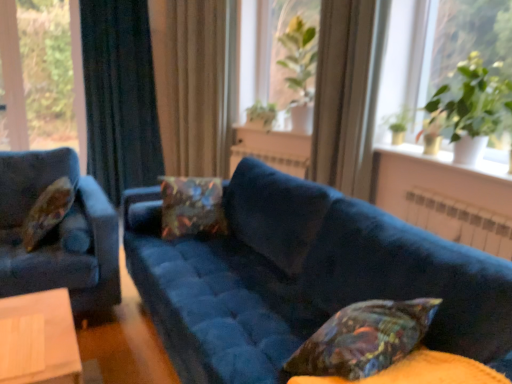
Locate an element on the screen. white metallic radiator at center is located at coordinates (460, 221).

This screenshot has width=512, height=384. What do you see at coordinates (47, 212) in the screenshot? I see `velvet floral pillow at left, which is counted as the 2th pillow, starting from the front` at bounding box center [47, 212].

What is the approximate width of white ceramic vase at upper right?

It is 37.43 centimeters.

Where is `beige fabric curtain at center, which is counted as the second curtain, starting from the left`? beige fabric curtain at center, which is counted as the second curtain, starting from the left is located at coordinates (191, 84).

Is velvet floral pillow at left, which is counted as the 2th pillow, starting from the front, shorter than green leafy plant at center, the 3th plant when ordered from left to right?

Correct, velvet floral pillow at left, which is counted as the 2th pillow, starting from the front, is not as tall as green leafy plant at center, the 3th plant when ordered from left to right.

Does velvet floral pillow at left, which appears as the first pillow when viewed from the left, lie behind green leafy plant at center, the 3th plant when ordered from left to right?

No, velvet floral pillow at left, which appears as the first pillow when viewed from the left, is closer to the camera.

This screenshot has height=384, width=512. I want to click on the 2nd pillow below the green leafy plant at center, the 3th plant when ordered from left to right (from the image's perspective), so click(x=47, y=212).

What's the angular difference between velvet floral pillow at left, which ranks as the 3th pillow in right-to-left order, and green leafy plant at center, the 3th plant when ordered from left to right,'s facing directions?

velvet floral pillow at left, which ranks as the 3th pillow in right-to-left order, and green leafy plant at center, the 3th plant when ordered from left to right, are facing 27.2 degrees away from each other.

Would you say velvet floral pillow at left, which ranks as the 3th pillow in right-to-left order, is to the left or to the right of dark blue velvet curtain at left, the 2th curtain in the right-to-left sequence, in the picture?

velvet floral pillow at left, which ranks as the 3th pillow in right-to-left order, is positioned on dark blue velvet curtain at left, the 2th curtain in the right-to-left sequence,'s right side.

From a real-world perspective, is velvet floral pillow at left, which is counted as the 2th pillow, starting from the front, under dark blue velvet curtain at left, the 2th curtain in the right-to-left sequence?

Indeed, from a real-world perspective, velvet floral pillow at left, which is counted as the 2th pillow, starting from the front, is positioned beneath dark blue velvet curtain at left, the 2th curtain in the right-to-left sequence.

Which is behind, point (49, 228) or point (149, 137)?

Point (149, 137)

Can you confirm if velvet floral pillow at left, which appears as the first pillow when viewed from the left, is taller than dark blue velvet curtain at left, the first curtain in the left-to-right sequence?

No.

Are green leafy plant at center, the 3th plant when ordered from left to right, and white metallic radiator at center far apart?

Yes, green leafy plant at center, the 3th plant when ordered from left to right, and white metallic radiator at center are quite far apart.

Between point (267, 103) and point (501, 252), which one is positioned behind?

Positioned behind is point (267, 103).

From the image's perspective, which one is positioned higher, green leafy plant at center, the 2th plant from the front, or white metallic radiator at center?

green leafy plant at center, the 2th plant from the front, appears higher in the image.

In terms of width, does velvet blue couch at center look wider or thinner when compared to velvet floral pillow at left, which is counted as the 2th pillow, starting from the front?

Considering their sizes, velvet blue couch at center looks broader than velvet floral pillow at left, which is counted as the 2th pillow, starting from the front.

From a real-world perspective, is velvet blue couch at center physically above velvet floral pillow at left, acting as the 2th pillow starting from the back?

Actually, velvet blue couch at center is physically below velvet floral pillow at left, acting as the 2th pillow starting from the back, in the real world.

In the scene shown: Is velvet blue couch at center oriented towards velvet floral pillow at left, which ranks as the 3th pillow in right-to-left order?

Yes, velvet blue couch at center is facing velvet floral pillow at left, which ranks as the 3th pillow in right-to-left order.

From the image's perspective, which one is positioned lower, velvet blue couch at center or velvet floral pillow at left, which is counted as the 2th pillow, starting from the front?

From the image's view, velvet blue couch at center is below.

Considering the relative positions of velvet floral pillow at left, which appears as the first pillow when viewed from the left, and green glossy plant at upper right, arranged as the 1th plant when viewed from the right, in the image provided, is velvet floral pillow at left, which appears as the first pillow when viewed from the left, in front of green glossy plant at upper right, arranged as the 1th plant when viewed from the right,?

No, velvet floral pillow at left, which appears as the first pillow when viewed from the left, is further to the viewer.

Is velvet floral pillow at left, acting as the 2th pillow starting from the back, looking in the opposite direction of green glossy plant at upper right, acting as the 4th plant starting from the back?

Correct, velvet floral pillow at left, acting as the 2th pillow starting from the back, is looking away from green glossy plant at upper right, acting as the 4th plant starting from the back.

From a real-world perspective, does velvet floral pillow at left, which is counted as the 2th pillow, starting from the front, stand above green glossy plant at upper right, positioned as the 4th plant in left-to-right order?

No, from a real-world perspective, velvet floral pillow at left, which is counted as the 2th pillow, starting from the front, is not on top of green glossy plant at upper right, positioned as the 4th plant in left-to-right order.

Identify the location of the 2nd plant located above the velvet floral pillow at left, which is counted as the 2th pillow, starting from the front (from a real-world perspective). The width and height of the screenshot is (512, 384). (471, 101).

Is velvet blue couch at center in contact with green leafy plant at center, the 3th plant when ordered from left to right?

No, velvet blue couch at center is not in contact with green leafy plant at center, the 3th plant when ordered from left to right.

There is a velvet blue couch at center. In order to click on the 4th plant above it (from a real-world perspective) in this screenshot , I will do `click(290, 77)`.

Is velvet blue couch at center looking in the opposite direction of green leafy plant at center, the 2th plant from the front?

No, velvet blue couch at center is not facing the opposite direction of green leafy plant at center, the 2th plant from the front.

From a real-world perspective, between velvet blue couch at center and green leafy plant at center, placed as the second plant when sorted from right to left, who is vertically lower?

From a 3D spatial view, velvet blue couch at center is below.

From a real-world perspective, who is located higher, green leafy plant at center, the 3th plant when ordered from left to right, or velvet blue couch at center?

In real-world perspective, green leafy plant at center, the 3th plant when ordered from left to right, is above.

Between green leafy plant at center, the 3th plant when ordered from left to right, and velvet blue couch at center, which one appears on the right side from the viewer's perspective?

From the viewer's perspective, green leafy plant at center, the 3th plant when ordered from left to right, appears more on the right side.

Locate an element on the screen. The image size is (512, 384). the 2nd plant behind the velvet blue couch at center is located at coordinates (290, 77).

From the image's perspective, is green leafy plant at center, the 3th plant when ordered from left to right, positioned above or below velvet blue couch at center?

green leafy plant at center, the 3th plant when ordered from left to right, is above velvet blue couch at center.

Image resolution: width=512 pixels, height=384 pixels. I want to click on plant that is the 3rd one when counting upward from the velvet floral pillow at left, which is counted as the 2th pillow, starting from the front (from the image's perspective), so click(x=290, y=77).

From the dark blue velvet curtain at left, the first curtain in the left-to-right sequence, count 2nd pillows forward and point to it. Please provide its 2D coordinates.

[(47, 212)]

Based on their spatial positions, is green leafy plant at center, the 3th plant viewed from the back, or floral-patterned fabric pillow at center, which is the 2th pillow from left to right, further from green leafy plant at center, which is the second plant in back-to-front order?

floral-patterned fabric pillow at center, which is the 2th pillow from left to right, is further to green leafy plant at center, which is the second plant in back-to-front order.

Considering their positions, is white ceramic vase at upper right positioned further to green leafy plant at upper left, marked as the fourth plant in a front-to-back arrangement, than green leafy plant at center, which is the second plant in back-to-front order?

white ceramic vase at upper right lies further to green leafy plant at upper left, marked as the fourth plant in a front-to-back arrangement, than the other object.

Which object lies nearer to the anchor point beige fabric curtain at center, which is counted as the second curtain, starting from the left, green leafy plant at upper left, marked as the fourth plant in a front-to-back arrangement, or velvet blue couch at center?

velvet blue couch at center.

From the image, which object appears to be farther from white ceramic vase at upper right, green leafy plant at center, which is the second plant in back-to-front order, or dark blue velvet curtain at left, the first curtain in the left-to-right sequence?

dark blue velvet curtain at left, the first curtain in the left-to-right sequence.

From the image, which object appears to be farther from green glossy plant at upper right, which ranks as the first plant in front-to-back order, velvet-like multicolored pillow at lower right, placed as the first pillow when sorted from front to back, or white metallic radiator at center?

Based on the image, velvet-like multicolored pillow at lower right, placed as the first pillow when sorted from front to back, appears to be further to green glossy plant at upper right, which ranks as the first plant in front-to-back order.

Which object lies further to the anchor point beige fabric curtain at center, which is counted as the second curtain, starting from the left, white ceramic vase at upper right or green leafy plant at center, the 2th plant from the front?

white ceramic vase at upper right lies further to beige fabric curtain at center, which is counted as the second curtain, starting from the left, than the other object.

Considering their positions, is green leafy plant at upper left, marked as the fourth plant in a front-to-back arrangement, positioned closer to velvet blue couch at center than green leafy plant at upper right?

green leafy plant at upper right lies closer to velvet blue couch at center than the other object.

In the scene shown: When comparing their distances from green leafy plant at center, positioned as the third plant in front-to-back order, does beige fabric curtain at center, which is the first curtain from right to left, or velvet floral pillow at left, which is counted as the 2th pillow, starting from the front, seem further?

velvet floral pillow at left, which is counted as the 2th pillow, starting from the front, is further to green leafy plant at center, positioned as the third plant in front-to-back order.

Identify the location of radiator located between velvet blue couch at center and white ceramic vase at upper right in the depth direction. (460, 221).

Find the location of a particular element. The image size is (512, 384). plant between velvet blue couch at center and white metallic radiator at center along the z-axis is located at coordinates (471, 101).

Image resolution: width=512 pixels, height=384 pixels. What are the coordinates of `window sill located between velvet blue couch at center and beige fabric curtain at center, which is counted as the second curtain, starting from the left, in the depth direction` in the screenshot? It's located at (453, 159).

At what (x,y) coordinates should I click in order to perform the action: click on window sill between velvet blue couch at center and green leafy plant at upper right in the front-back direction. Please return your answer as a coordinate pair (x, y). The width and height of the screenshot is (512, 384). Looking at the image, I should click on coord(453,159).